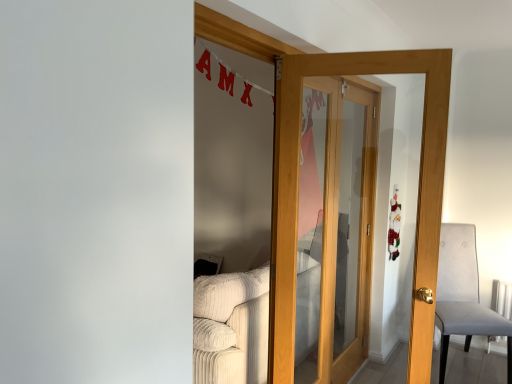
What do you see at coordinates (231, 328) in the screenshot? Image resolution: width=512 pixels, height=384 pixels. I see `beige corduroy couch at lower left` at bounding box center [231, 328].

Locate an element on the screen. This screenshot has height=384, width=512. light brown wooden door at center is located at coordinates (297, 175).

Based on the photo, is the surface of beige corduroy couch at lower left in direct contact with gray fabric chair at right?

beige corduroy couch at lower left and gray fabric chair at right are not in contact.

How many degrees apart are the facing directions of beige corduroy couch at lower left and gray fabric chair at right?

121 degrees.

Can you confirm if beige corduroy couch at lower left is positioned to the left of gray fabric chair at right?

Yes, beige corduroy couch at lower left is to the left of gray fabric chair at right.

Which object is further away from the camera taking this photo, gray fabric chair at right or beige corduroy couch at lower left?

gray fabric chair at right is more distant.

What's the angular difference between gray fabric chair at right and beige corduroy couch at lower left's facing directions?

The facing directions of gray fabric chair at right and beige corduroy couch at lower left are 121 degrees apart.

Is there a large distance between gray fabric chair at right and beige corduroy couch at lower left?

Yes, gray fabric chair at right and beige corduroy couch at lower left are quite far apart.

From the image's perspective, which is below, gray fabric chair at right or beige corduroy couch at lower left?

beige corduroy couch at lower left, from the image's perspective.

Considering the positions of objects light brown wooden door at center and beige corduroy couch at lower left in the image provided, who is more to the right, light brown wooden door at center or beige corduroy couch at lower left?

From the viewer's perspective, light brown wooden door at center appears more on the right side.

Where is `door that appears in front of the beige corduroy couch at lower left`? This screenshot has width=512, height=384. door that appears in front of the beige corduroy couch at lower left is located at coordinates click(x=297, y=175).

Considering the points (291, 72) and (260, 374), which point is behind, point (291, 72) or point (260, 374)?

Positioned behind is point (260, 374).

Is beige corduroy couch at lower left surrounded by light brown wooden door at center?

No, beige corduroy couch at lower left is not inside light brown wooden door at center.

Would you say gray fabric chair at right contains light brown wooden door at center?

Actually, light brown wooden door at center is outside gray fabric chair at right.

How many degrees apart are the facing directions of gray fabric chair at right and light brown wooden door at center?

The angle between the facing direction of gray fabric chair at right and the facing direction of light brown wooden door at center is 13.1 degrees.

Between gray fabric chair at right and light brown wooden door at center, which one has less height?

With less height is gray fabric chair at right.

Is gray fabric chair at right far from light brown wooden door at center?

Yes, gray fabric chair at right and light brown wooden door at center are located far from each other.

In terms of width, does beige corduroy couch at lower left look wider or thinner when compared to light brown wooden door at center?

In the image, beige corduroy couch at lower left appears to be wider than light brown wooden door at center.

Does point (297, 329) lie behind point (289, 349)?

Yes, point (297, 329) is farther from viewer.

From the image's perspective, is beige corduroy couch at lower left on top of light brown wooden door at center?

No, from the image's perspective, beige corduroy couch at lower left is not on top of light brown wooden door at center.

From their relative heights in the image, would you say beige corduroy couch at lower left is taller or shorter than light brown wooden door at center?

Clearly, beige corduroy couch at lower left is shorter compared to light brown wooden door at center.

Is light brown wooden door at center far away from gray fabric chair at right?

Yes, light brown wooden door at center and gray fabric chair at right are quite far apart.

From the image's perspective, which one is positioned higher, light brown wooden door at center or gray fabric chair at right?

light brown wooden door at center appears higher in the image.

At what (x,y) coordinates should I click in order to perform the action: click on door that is on the left side of gray fabric chair at right. Please return your answer as a coordinate pair (x, y). This screenshot has height=384, width=512. Looking at the image, I should click on (297, 175).

This screenshot has width=512, height=384. In order to click on couch on the left of gray fabric chair at right in this screenshot , I will do `click(231, 328)`.

You are a GUI agent. You are given a task and a screenshot of the screen. Output one action in this format:
    pyautogui.click(x=<x>, y=<y>)
    Task: Click on the chair lying on the right of beige corduroy couch at lower left
    
    Given the screenshot: What is the action you would take?
    pyautogui.click(x=464, y=295)

Looking at the image, which one is located closer to gray fabric chair at right, light brown wooden door at center or beige corduroy couch at lower left?

light brown wooden door at center is positioned closer to the anchor gray fabric chair at right.

When comparing their distances from gray fabric chair at right, does beige corduroy couch at lower left or light brown wooden door at center seem closer?

light brown wooden door at center lies closer to gray fabric chair at right than the other object.

Considering their positions, is gray fabric chair at right positioned closer to beige corduroy couch at lower left than light brown wooden door at center?

light brown wooden door at center is positioned closer to the anchor beige corduroy couch at lower left.

Consider the image. Estimate the real-world distances between objects in this image. Which object is further from light brown wooden door at center, beige corduroy couch at lower left or gray fabric chair at right?

gray fabric chair at right is positioned further to the anchor light brown wooden door at center.

Estimate the real-world distances between objects in this image. Which object is closer to light brown wooden door at center, gray fabric chair at right or beige corduroy couch at lower left?

beige corduroy couch at lower left is positioned closer to the anchor light brown wooden door at center.

Estimate the real-world distances between objects in this image. Which object is closer to beige corduroy couch at lower left, light brown wooden door at center or gray fabric chair at right?

light brown wooden door at center is positioned closer to the anchor beige corduroy couch at lower left.

Where is `door between beige corduroy couch at lower left and gray fabric chair at right from left to right`? door between beige corduroy couch at lower left and gray fabric chair at right from left to right is located at coordinates (297, 175).